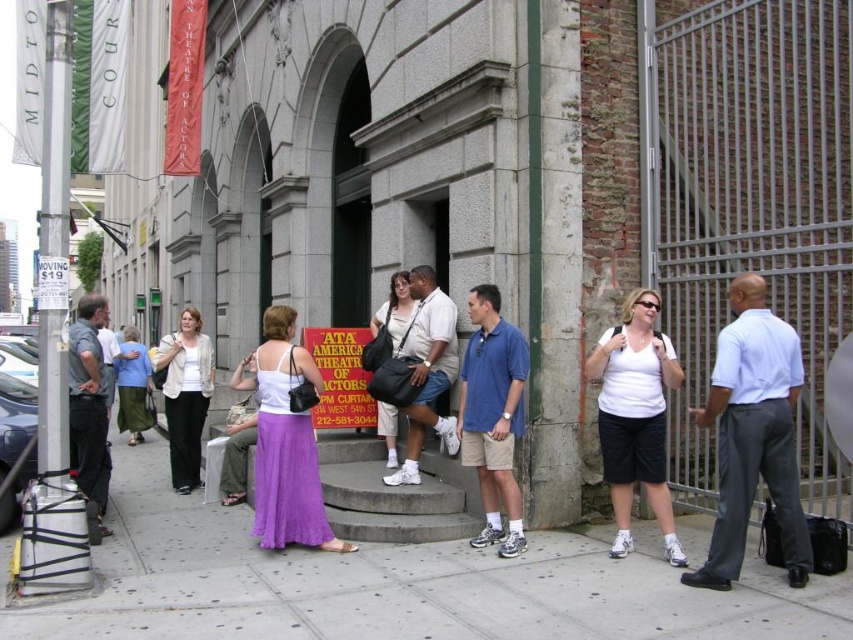
You are a costume designer preparing for a play. You need to choose between the white shirt at right and the white matte tank top at center for a character who requires a larger garment. Which one should you select?

The white shirt at right is bigger than the white matte tank top at center, so you should select the white shirt at right for the character who requires a larger garment.